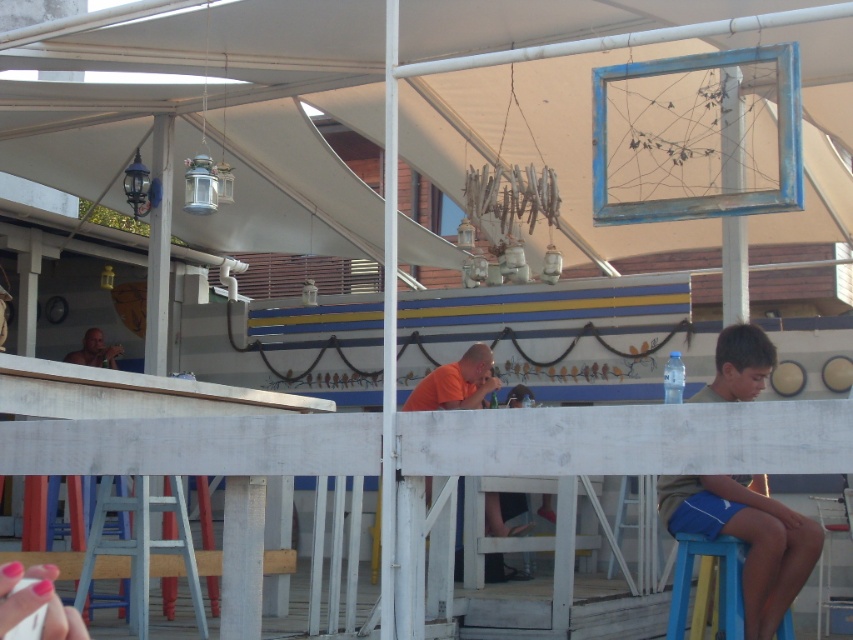
You are standing at the edge of the patio looking towards the seating area. There is a light brown shorts at right and a shiny orange shirt at upper left. Which object is located lower in the image?

The light brown shorts at right is positioned under the shiny orange shirt at upper left, so it is lower in the image.

You are standing at the edge of the patio and want to walk towards the two points marked in the image. Which point, point (x=752, y=600) or point (x=112, y=365), will you reach first?

Point (x=752, y=600) is closer to the viewer than point (x=112, y=365), so you will reach point (x=752, y=600) first.

You are a photographer trying to capture a group photo of the orange matte shirt at center and the blue plastic stool at lower right. If you want to ensure both subjects are fully visible in the frame, which subject should you position closer to the camera to avoid cropping?

The orange matte shirt at center is wider than the blue plastic stool at lower right, so positioning the orange matte shirt at center closer to the camera will help ensure its full visibility without cropping, as wider objects need to be closer to maintain visibility in the frame.